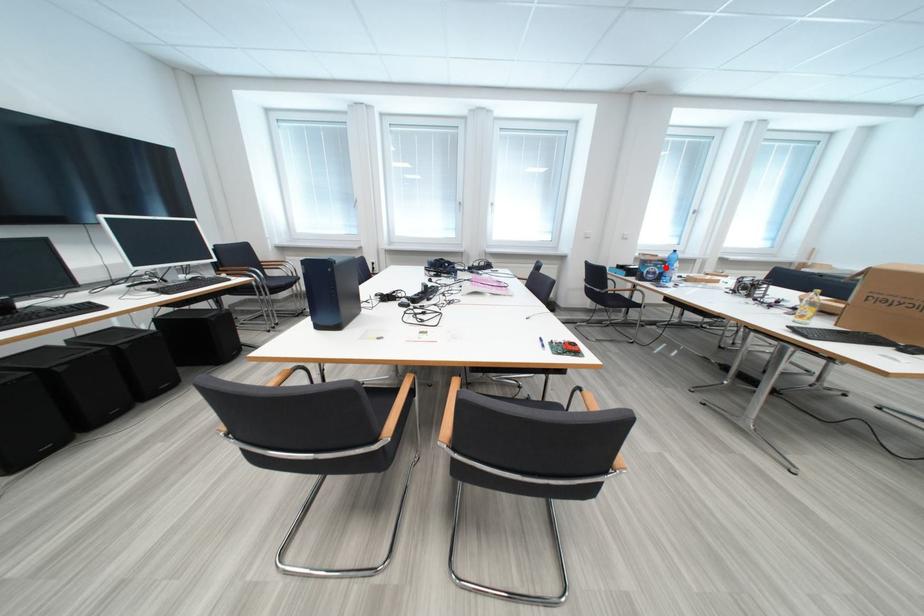
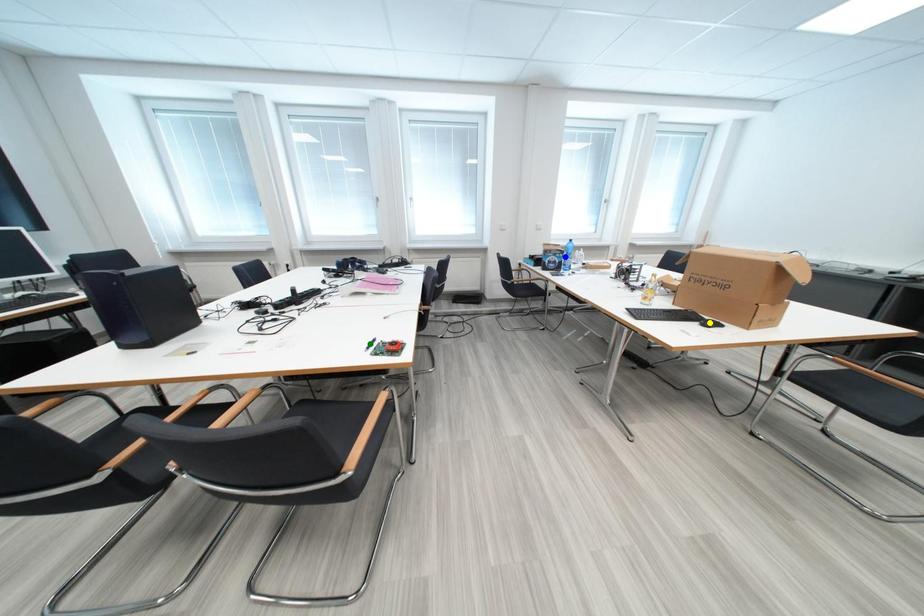
Question: I am providing you with two images of the same scene from different viewpoints. A red point is marked on the first image. You are given multiple points on the second image. Which spot in image 2 lines up with the point in image 1?

Choices:
 (A) green point
 (B) blue point
 (C) yellow point

Answer: (B)